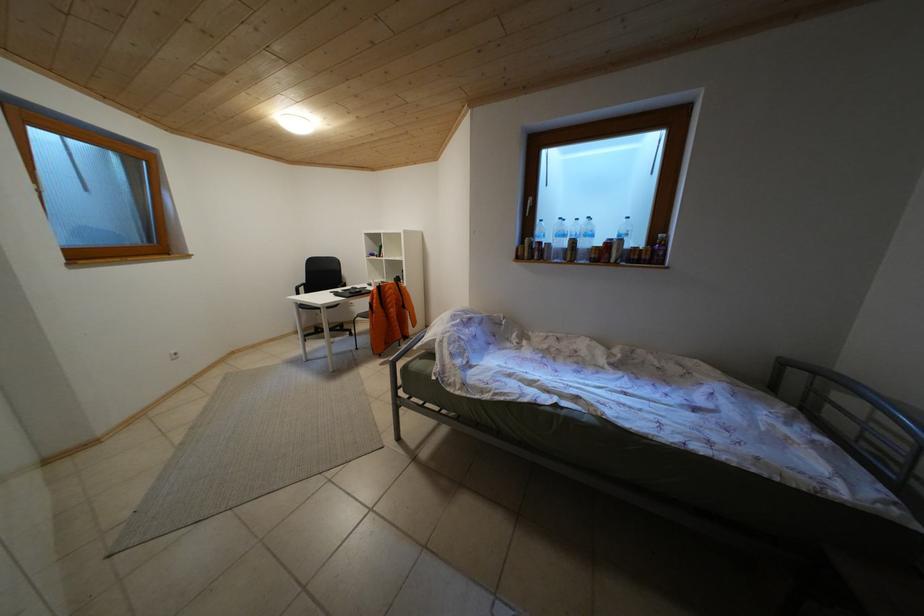
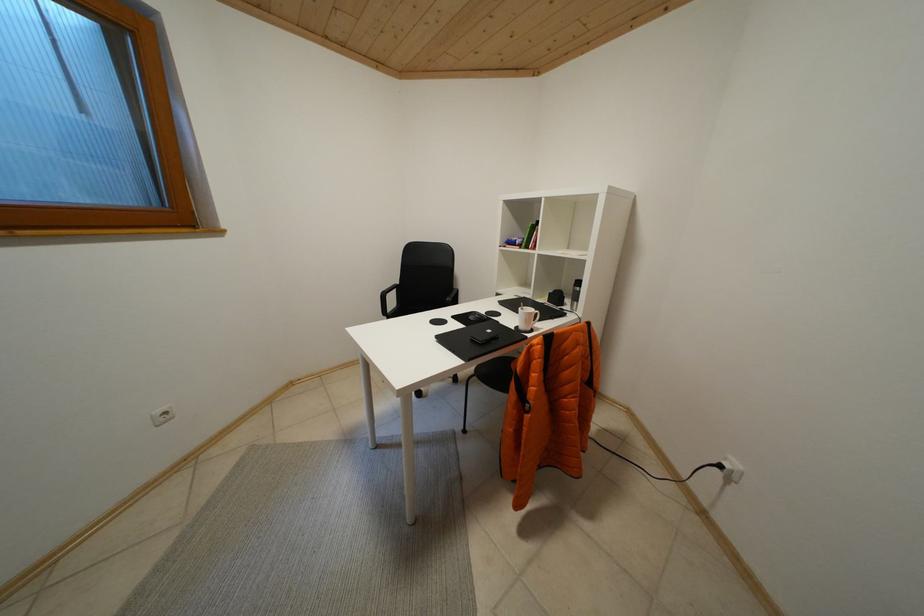
The images are taken continuously from a first-person perspective. In which direction are you moving?

The cameraman moved toward left, forward.